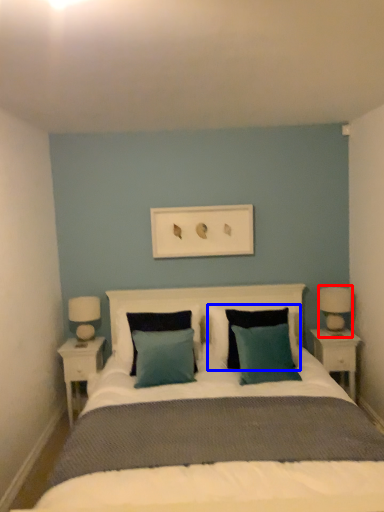
Question: Which object appears farthest to the camera in this image, bedside lamp (highlighted by a red box) or pillow (highlighted by a blue box)?

Choices:
 (A) bedside lamp
 (B) pillow

Answer: (A)